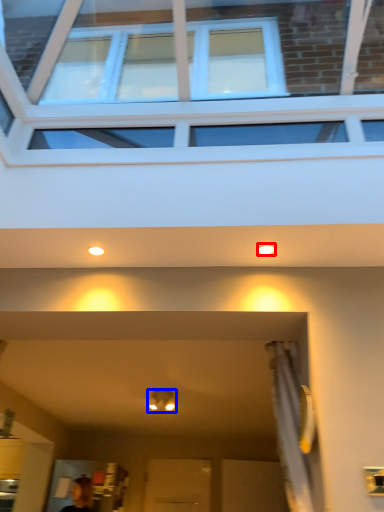
Question: Which object is closer to the camera taking this photo, lighting (highlighted by a red box) or light fixture (highlighted by a blue box)?

Choices:
 (A) lighting
 (B) light fixture

Answer: (A)